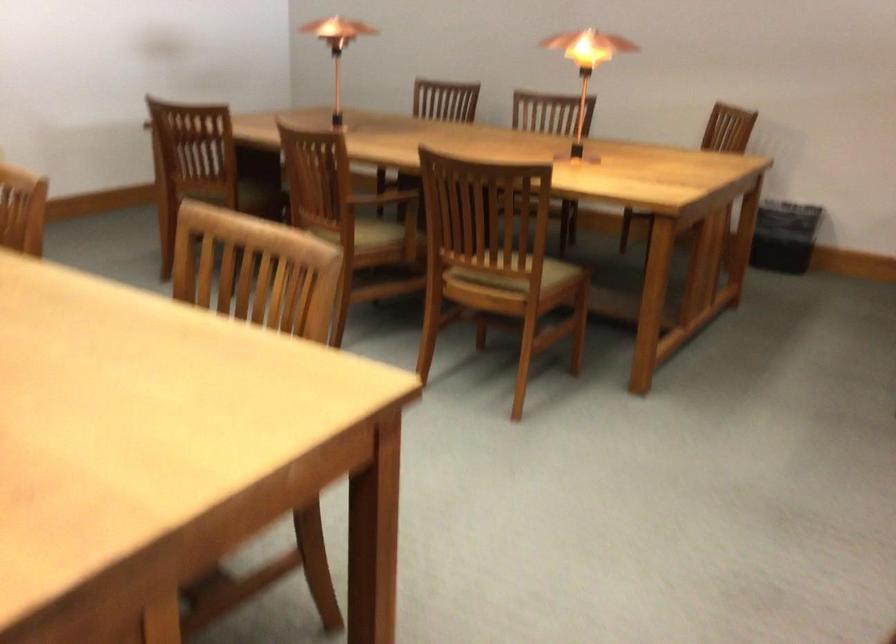
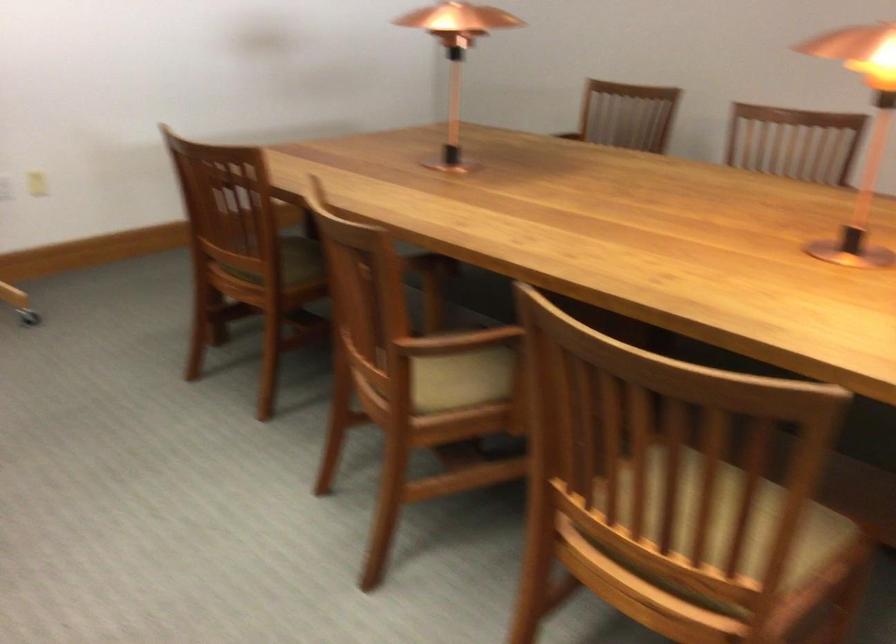
Find the pixel in the second image that matches (x=380, y=194) in the first image.

(455, 342)